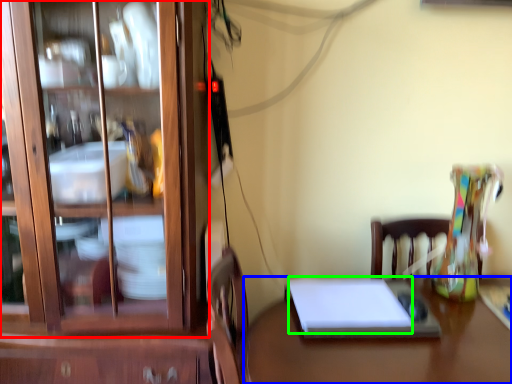
Question: Based on their relative distances, which object is farther from cabinetry (highlighted by a red box)? Choose from desk (highlighted by a blue box) and notebook (highlighted by a green box).

Choices:
 (A) desk
 (B) notebook

Answer: (A)